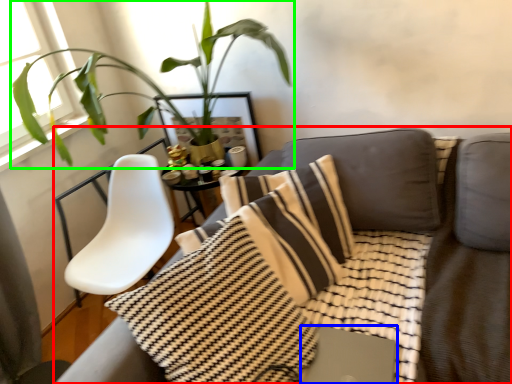
Question: Which object is the closest to the studio couch (highlighted by a red box)? Choose among these: computer (highlighted by a blue box) or houseplant (highlighted by a green box).

Choices:
 (A) computer
 (B) houseplant

Answer: (A)